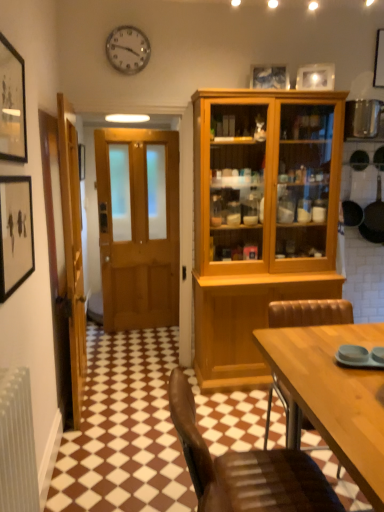
I want to click on vacant area in front of brown wooden door at center, the 1th door in the right-to-left sequence, so click(139, 386).